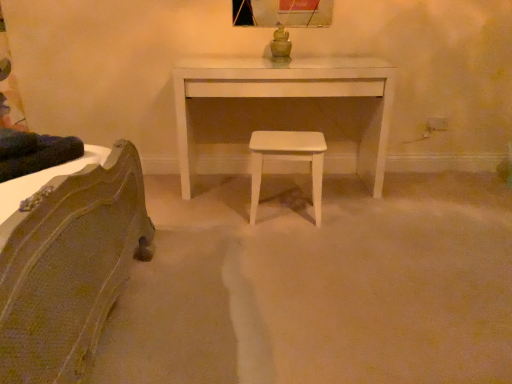
Question: Is white wood stool at center inside or outside of white matte table at center?

Choices:
 (A) inside
 (B) outside

Answer: (B)

Question: Is point (257, 180) closer or farther from the camera than point (185, 157)?

Choices:
 (A) farther
 (B) closer

Answer: (B)

Question: In terms of height, does white wood stool at center look taller or shorter compared to white matte table at center?

Choices:
 (A) tall
 (B) short

Answer: (B)

Question: From the image's perspective, is white matte table at center above or below white wood stool at center?

Choices:
 (A) above
 (B) below

Answer: (A)

Question: Is white matte table at center wider or thinner than white wood stool at center?

Choices:
 (A) thin
 (B) wide

Answer: (B)

Question: Considering the positions of point (205, 84) and point (322, 152), is point (205, 84) closer or farther from the camera than point (322, 152)?

Choices:
 (A) farther
 (B) closer

Answer: (A)

Question: Is white matte table at center taller or shorter than white wood stool at center?

Choices:
 (A) short
 (B) tall

Answer: (B)